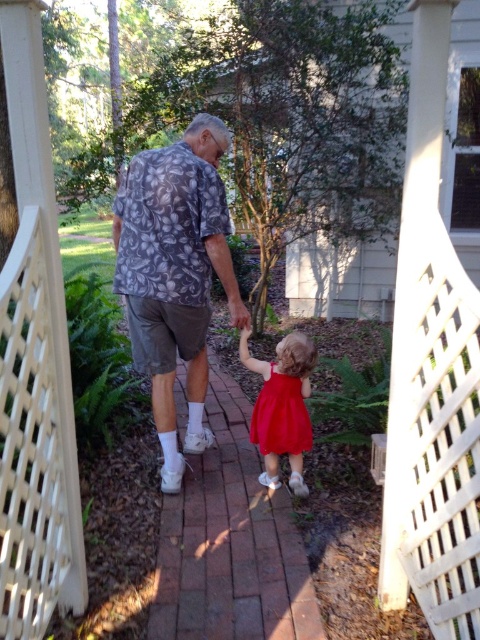
Question: Among these points, which one is farthest from the camera?

Choices:
 (A) (194, 202)
 (B) (300, 333)

Answer: (B)

Question: Does floral fabric shirt at center have a larger size compared to matte red dress at center?

Choices:
 (A) no
 (B) yes

Answer: (B)

Question: Which point is closer to the camera?

Choices:
 (A) (282, 397)
 (B) (200, 477)
 (C) (180, 486)

Answer: (A)

Question: Is floral fabric shirt at center behind matte red dress at center?

Choices:
 (A) yes
 (B) no

Answer: (B)

Question: Does red satin dress at center have a larger size compared to matte red dress at center?

Choices:
 (A) no
 (B) yes

Answer: (B)

Question: Which of the following is the closest to the observer?

Choices:
 (A) (194, 589)
 (B) (180, 193)
 (C) (265, 412)

Answer: (A)